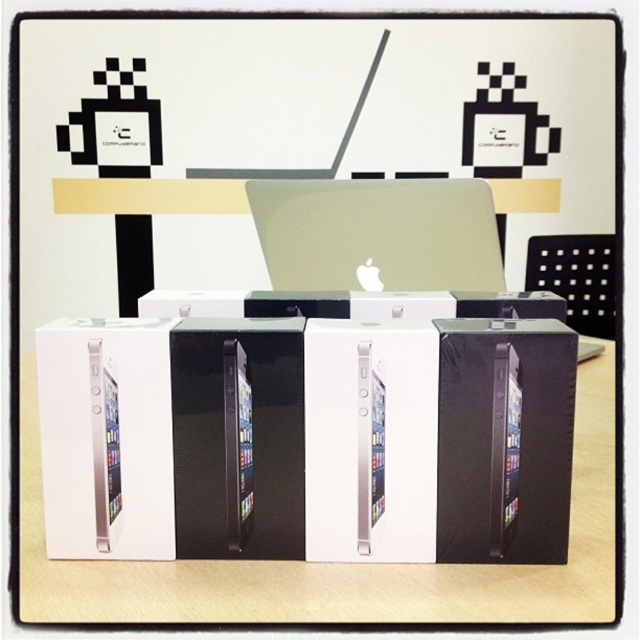
You are looking at the image of Apple product packaging. There are two points marked in the scene. Which point is closer to you, point (26, 576) or point (420, 284)?

Point (26, 576) is closer to the viewer than point (420, 284).

You are setting up a display for an Apple product showcase. You have a white cardboard boxes at center and a satin silver laptop at center. Which object should you place higher to ensure the laptop is visible above the boxes?

The satin silver laptop at center should be placed higher than the white cardboard boxes at center because the white cardboard boxes at center is positioned under the satin silver laptop at center.